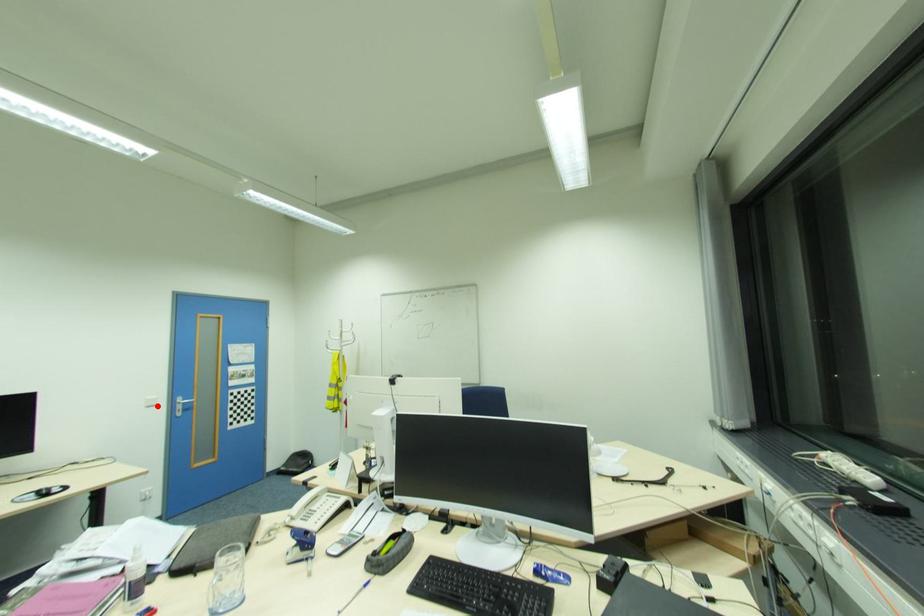
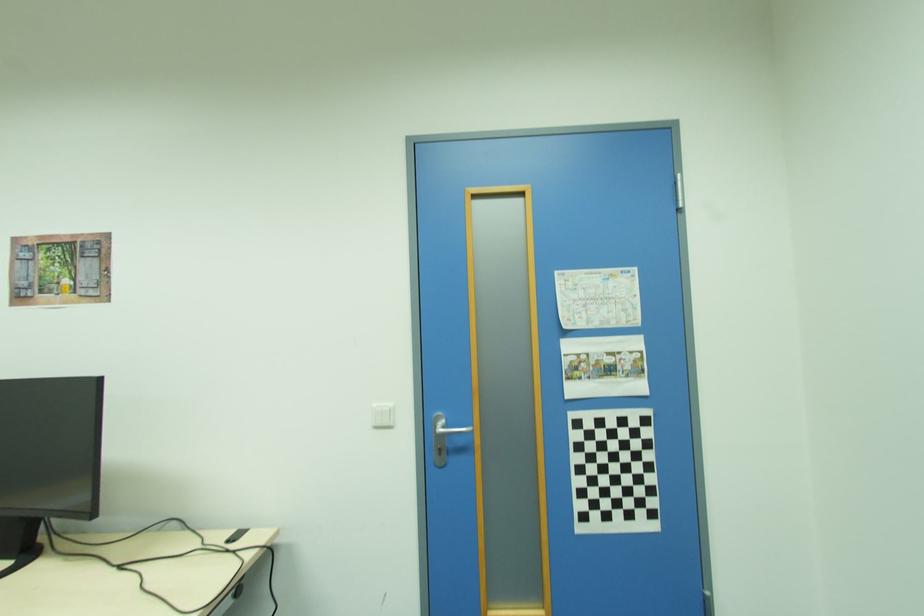
The point at the highlighted location is marked in the first image. Where is the corresponding point in the second image?

(394, 427)